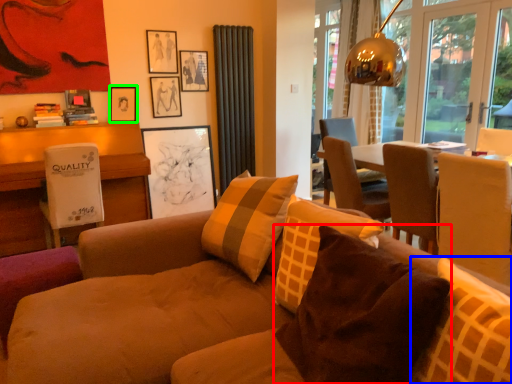
Question: Which is farther away from pillow (highlighted by a red box)? pillow (highlighted by a blue box) or picture frame (highlighted by a green box)?

Choices:
 (A) pillow
 (B) picture frame

Answer: (B)